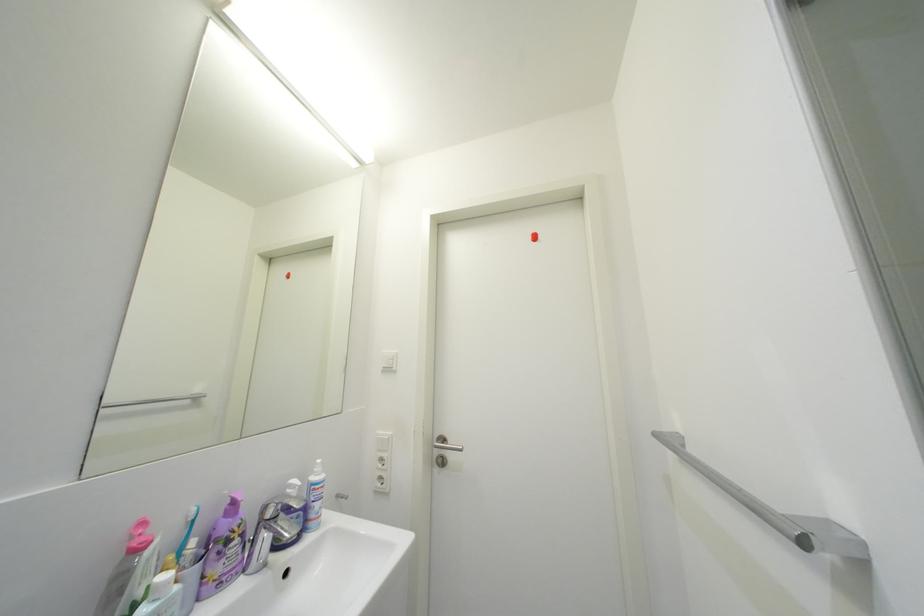
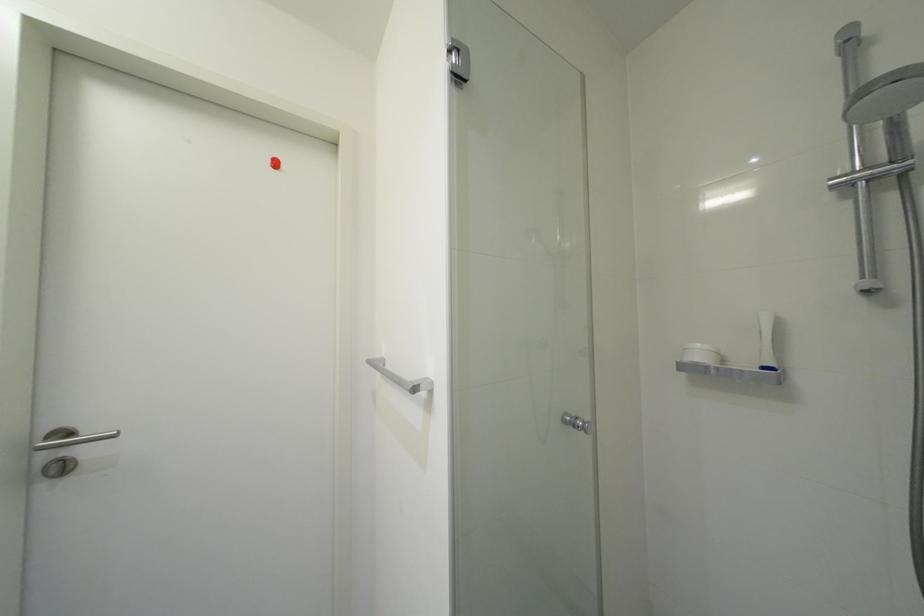
Question: The images are taken continuously from a first-person perspective. In which direction is your viewpoint rotating?

Choices:
 (A) Left
 (B) Right
 (C) Up
 (D) Down

Answer: (B)